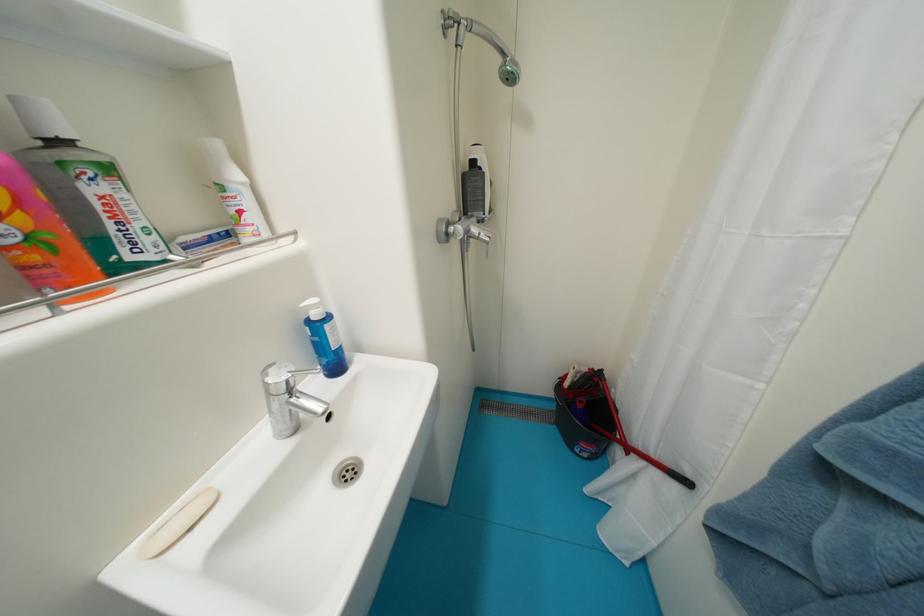
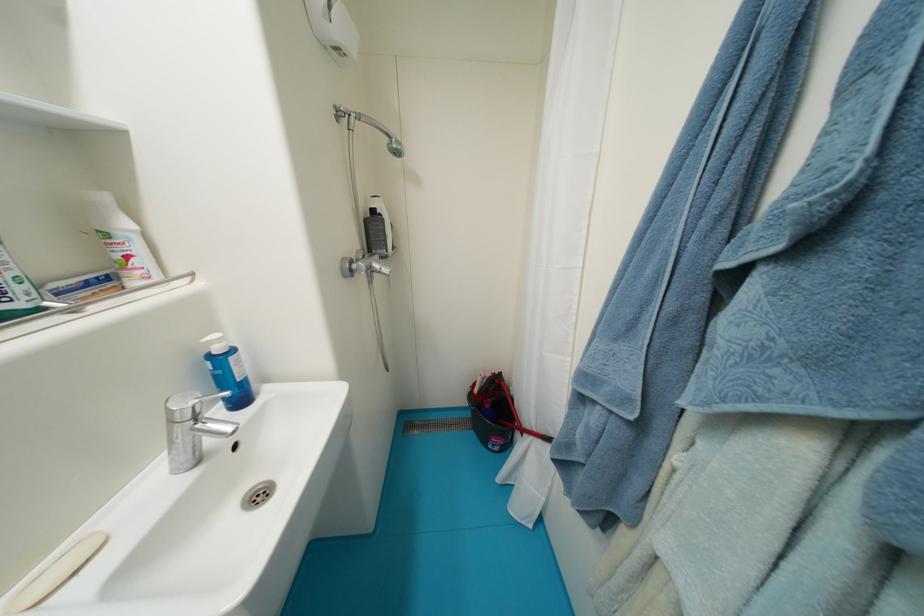
The point at (481,231) is marked in the first image. Where is the corresponding point in the second image?

(383, 267)